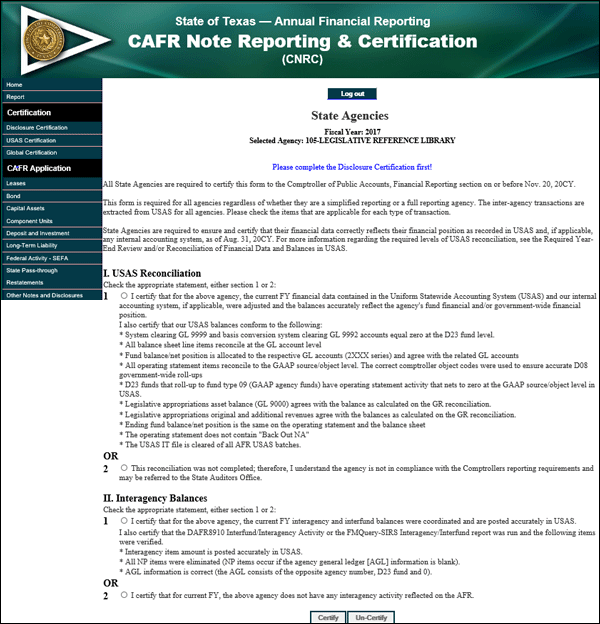
In order to click on the top header wallpaper in this screenshot , I will do `click(521, 37)`.